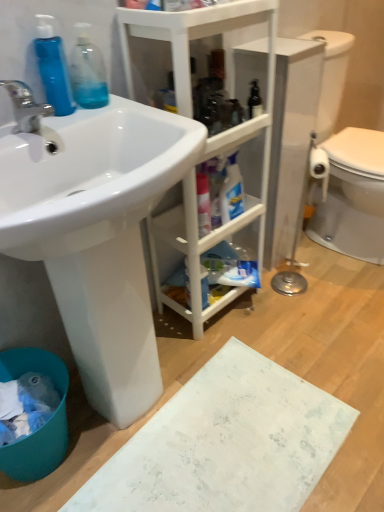
Find the location of a particular element. This screenshot has height=512, width=384. vacant point to the right of white glossy sink at upper left is located at coordinates (292, 364).